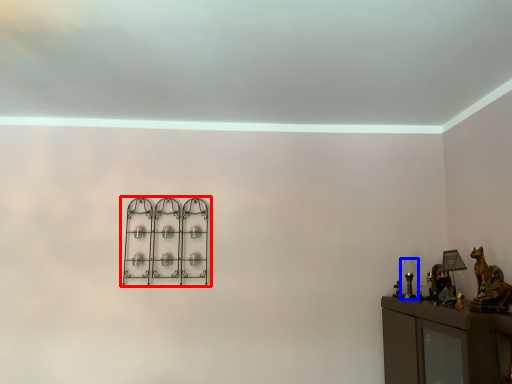
Question: Which point is closer to the camera, shelf (highlighted by a red box) or table lamp (highlighted by a blue box)?

Choices:
 (A) shelf
 (B) table lamp

Answer: (B)